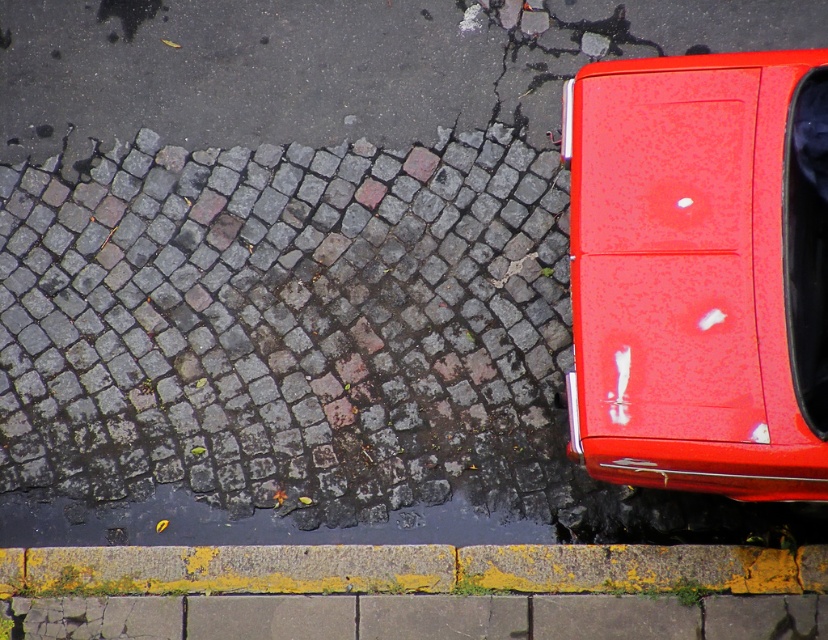
Between glossy red car at lower right and yellow painted concrete curb at lower center, which one appears on the right side from the viewer's perspective?

From the viewer's perspective, glossy red car at lower right appears more on the right side.

Between glossy red car at lower right and yellow painted concrete curb at lower center, which one is positioned higher?

glossy red car at lower right is above.

Locate an element on the screen. The image size is (828, 640). glossy red car at lower right is located at coordinates (696, 275).